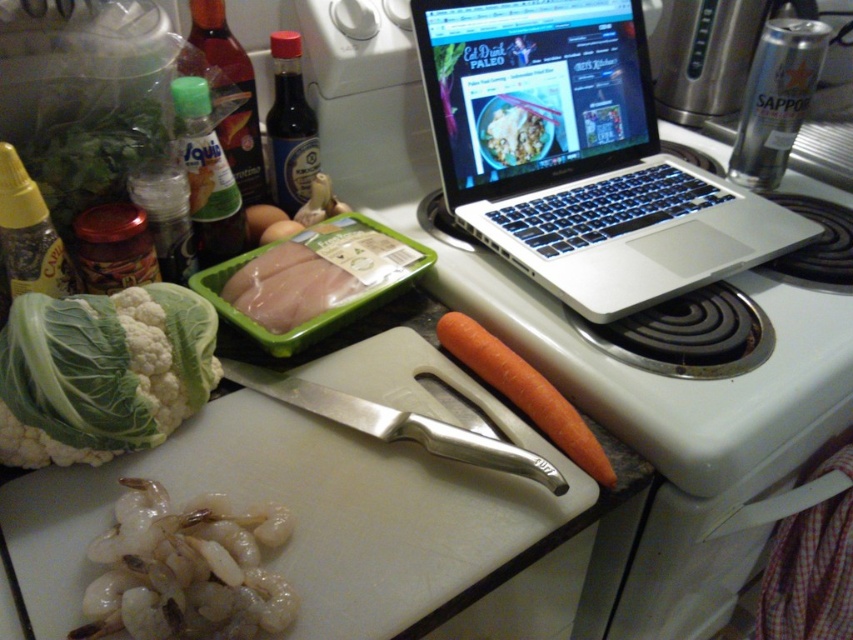
You are preparing a meal and need to choose between the green leafy cabbage at left and the smooth white rice bowl at center. Which item is bigger in size?

The green leafy cabbage at left is larger in size compared to the smooth white rice bowl at center.

You are preparing a meal and need to place both the silver metallic knife at center and the smooth white rice bowl at center on a shelf that can only accommodate one item. Which item should you choose to fit on the shelf?

The smooth white rice bowl at center should be placed on the shelf since the silver metallic knife at center is wider and won

You are organizing the kitchen countertop and need to place a new item between the green leafy cabbage at left and the package of raw chicken breasts in a green tray. Based on their positions, which object is closer to the left edge of the countertop?

The green leafy cabbage at left is located at point (102, 372), which is closer to the left edge of the countertop compared to the package of raw chicken breasts in a green tray. Therefore, the green leafy cabbage at left is closer to the left edge.